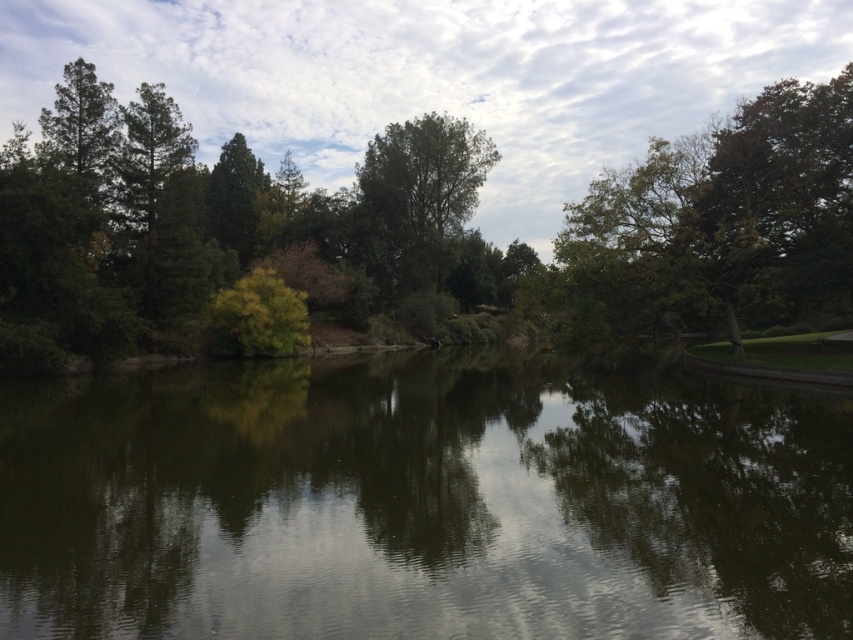
You are an artist planning to paint the scene. You want to ensure the green reflective water at center and the green matte tree at center are proportionally accurate. Which object should you paint larger in your artwork?

The green matte tree at center should be painted larger because it occupies more space than the green reflective water at center according to the description.

You are standing on the edge of the pond and want to take a photo of both the green reflective water at center and the green leafy tree at center. Which object should you position closer to the left side of your camera frame?

You should position the green reflective water at center closer to the left side of your camera frame because it is already located to the left of the green leafy tree at center in the scene.